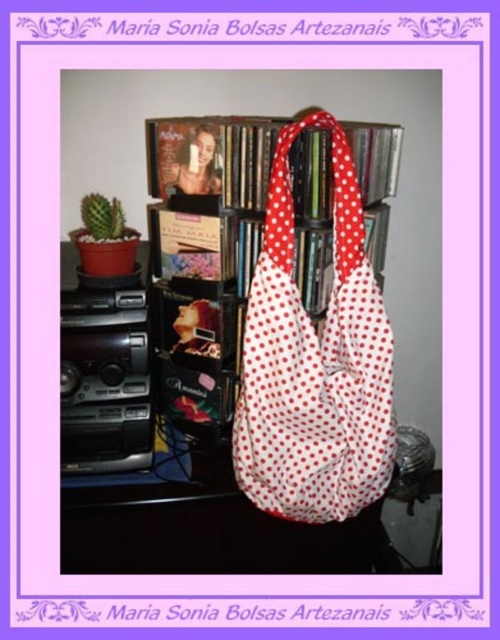
Does white fabric bag at center appear under white polka dot fabric shoulder bag at center?

Yes.

Does point (372, 275) come in front of point (366, 323)?

Yes, it is.

The width and height of the screenshot is (500, 640). What are the coordinates of `white fabric bag at center` in the screenshot? It's located at [x=274, y=428].